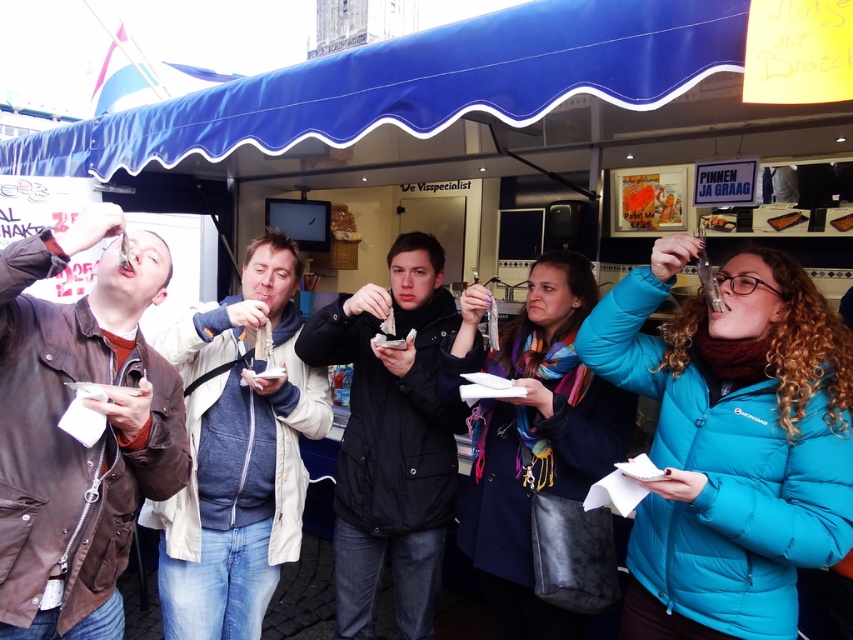
You are a customer at the food stall and want to take a photo of the teal puffer jacket at right and the blue fabric canopy at upper center. Which object should you focus on first if you want to capture both in a single frame without moving the camera?

You should focus on the blue fabric canopy at upper center first because the teal puffer jacket at right is positioned to its right side, so capturing the canopy first ensures both objects are within the frame.

You are standing at the food stall under the blue fabric canopy at upper center and want to reach the brown leather jacket at left to grab your coat. The stall has a narrow walkway between the canopy and the jacket. If the walkway is 4 feet wide, can you comfortably walk through it while carrying a tray of food?

The blue fabric canopy at upper center is 4.64 feet away from the brown leather jacket at left, so the 4 feet wide walkway is narrower than the distance between them. This might make it difficult to comfortably walk through while carrying a tray of food.

You are a customer at the food stall and want to know which item is taller between the blue quilted jacket at center and the brown wooden stick at upper center. Which one is taller?

The blue quilted jacket at center is taller than the brown wooden stick at upper center.